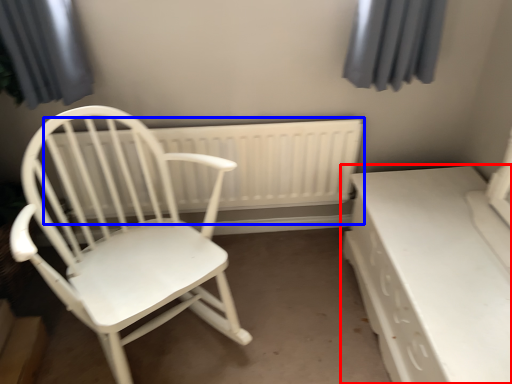
Question: Which point is further to the camera, table (highlighted by a red box) or radiator (highlighted by a blue box)?

Choices:
 (A) table
 (B) radiator

Answer: (B)